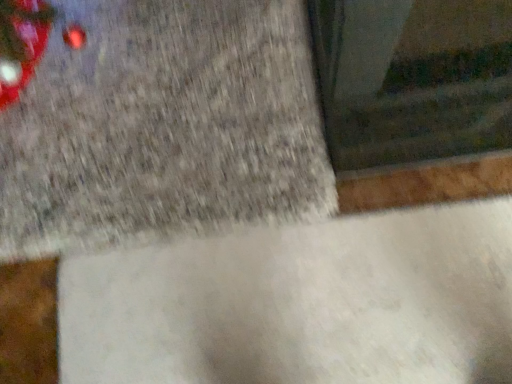
At what (x,y) coordinates should I click in order to perform the action: click on vacant area situated below gray concrete at upper left, the first concrete positioned from the top (from a real-world perspective). Please return your answer as a coordinate pair (x, y). Looking at the image, I should click on (144, 57).